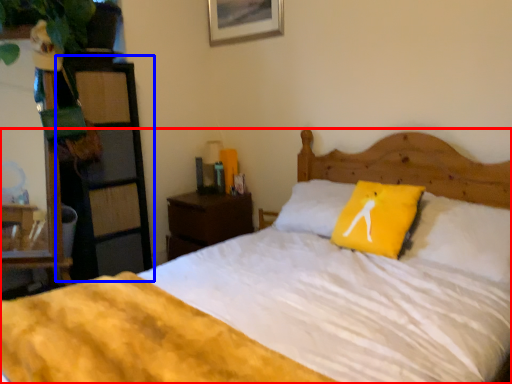
Question: Among these objects, which one is nearest to the camera, bed (highlighted by a red box) or dresser (highlighted by a blue box)?

Choices:
 (A) bed
 (B) dresser

Answer: (A)